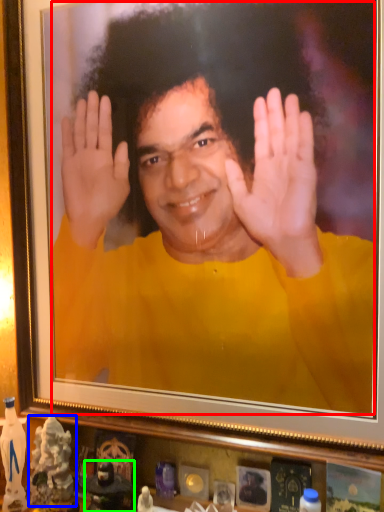
Question: Which is nearer to the man (highlighted by a red box)? toy (highlighted by a blue box) or toy (highlighted by a green box).

Choices:
 (A) toy
 (B) toy

Answer: (A)